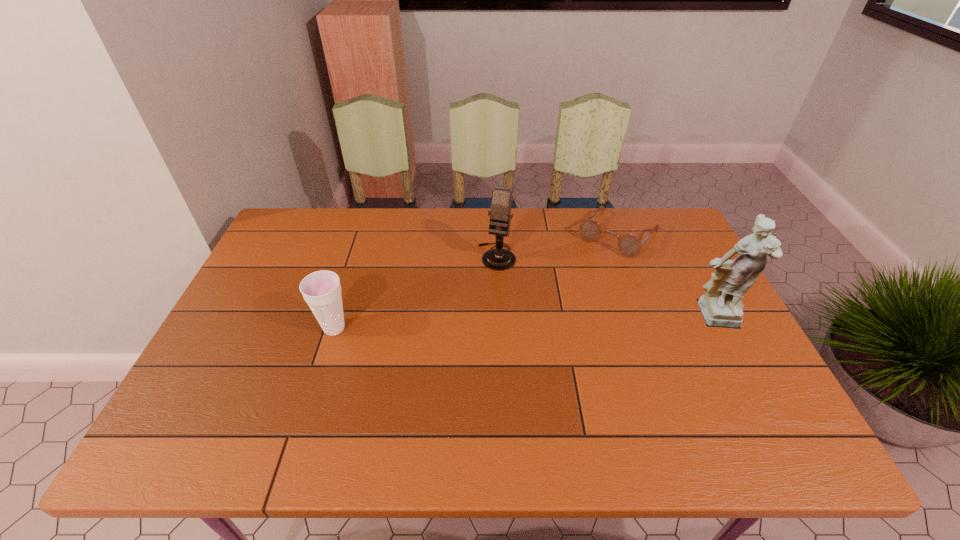
Identify the location of free space at the near edge of the desktop. (419, 389).

Where is `vacant space at the left edge of the desktop`? vacant space at the left edge of the desktop is located at coordinates (275, 307).

Where is `free location at the right edge`? This screenshot has height=540, width=960. free location at the right edge is located at coordinates (651, 267).

The width and height of the screenshot is (960, 540). In the image, there is a desktop. Identify the location of free space at the far left corner. (291, 238).

Locate an element on the screen. Image resolution: width=960 pixels, height=540 pixels. free spot between the figurine and the third object from right to left is located at coordinates (606, 287).

Where is `empty space between the figurine and the second shortest object`? This screenshot has width=960, height=540. empty space between the figurine and the second shortest object is located at coordinates (524, 323).

Find the location of a particular element. The height and width of the screenshot is (540, 960). vacant area between the figurine and the third object from right to left is located at coordinates (606, 287).

In order to click on blank region between the tallest object and the second object from left to right in this screenshot , I will do `click(606, 287)`.

Locate an element on the screen. The height and width of the screenshot is (540, 960). vacant space that is in between the shortest object and the leftmost object is located at coordinates (476, 281).

Where is `free space between the cup and the figurine`? free space between the cup and the figurine is located at coordinates (524, 323).